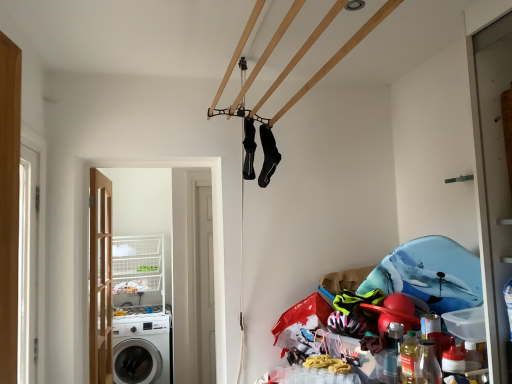
Question: From the image's perspective, is white wire basket at lower left beneath wooden door at left?

Choices:
 (A) yes
 (B) no

Answer: (A)

Question: Is white wire basket at lower left closer to the viewer compared to wooden door at left?

Choices:
 (A) no
 (B) yes

Answer: (A)

Question: From a real-world perspective, does white wire basket at lower left stand above wooden door at left?

Choices:
 (A) no
 (B) yes

Answer: (A)

Question: Is white wire basket at lower left to the right of wooden door at left from the viewer's perspective?

Choices:
 (A) yes
 (B) no

Answer: (B)

Question: From a real-world perspective, is white wire basket at lower left located beneath wooden door at left?

Choices:
 (A) yes
 (B) no

Answer: (A)

Question: Looking at the image, does black matte socks at upper center, marked as the 1th clothing in a right-to-left arrangement, seem bigger or smaller compared to white glossy washing machine at lower left?

Choices:
 (A) small
 (B) big

Answer: (A)

Question: Considering their positions, is black matte socks at upper center, marked as the 2th clothing in a left-to-right arrangement, located in front of or behind white glossy washing machine at lower left?

Choices:
 (A) front
 (B) behind

Answer: (A)

Question: From a real-world perspective, is black matte socks at upper center, marked as the 2th clothing in a left-to-right arrangement, above or below white glossy washing machine at lower left?

Choices:
 (A) above
 (B) below

Answer: (A)

Question: From their relative heights in the image, would you say black matte socks at upper center, marked as the 2th clothing in a left-to-right arrangement, is taller or shorter than white glossy washing machine at lower left?

Choices:
 (A) tall
 (B) short

Answer: (B)

Question: In terms of size, does black matte socks at upper center, marked as the 1th clothing in a right-to-left arrangement, appear bigger or smaller than black matte socks at center, the 1th clothing viewed from the left?

Choices:
 (A) small
 (B) big

Answer: (B)

Question: From a real-world perspective, relative to black matte socks at center, the second clothing in the right-to-left sequence, is black matte socks at upper center, marked as the 1th clothing in a right-to-left arrangement, vertically above or below?

Choices:
 (A) below
 (B) above

Answer: (A)

Question: Is black matte socks at upper center, marked as the 2th clothing in a left-to-right arrangement, spatially inside black matte socks at center, the 1th clothing viewed from the left, or outside of it?

Choices:
 (A) outside
 (B) inside

Answer: (A)

Question: Is black matte socks at upper center, marked as the 2th clothing in a left-to-right arrangement, to the left or to the right of black matte socks at center, the second clothing in the right-to-left sequence, in the image?

Choices:
 (A) right
 (B) left

Answer: (A)

Question: Would you say wooden door at left is inside or outside black matte socks at upper center, marked as the 1th clothing in a right-to-left arrangement?

Choices:
 (A) inside
 (B) outside

Answer: (B)

Question: From a real-world perspective, is wooden door at left above or below black matte socks at upper center, marked as the 2th clothing in a left-to-right arrangement?

Choices:
 (A) above
 (B) below

Answer: (B)